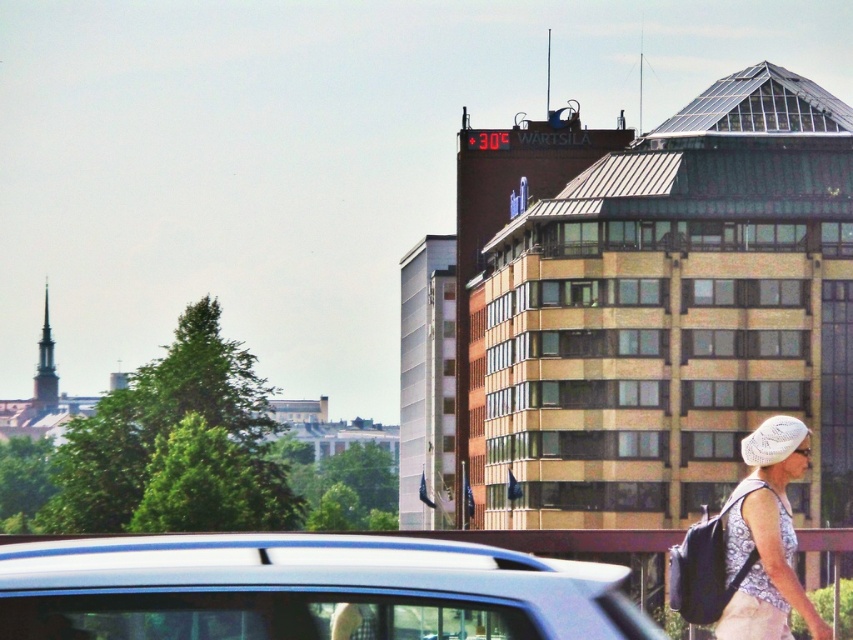
Is point (415, 547) more distant than point (802, 426)?

No, (415, 547) is closer to viewer.

How distant is metallic blue car at lower center from white lace hat at lower right?

They are 13.35 meters apart.

Between point (12, 552) and point (735, 509), which one is positioned behind?

The point (735, 509) is behind.

Find the location of a particular element. metallic blue car at lower center is located at coordinates (306, 589).